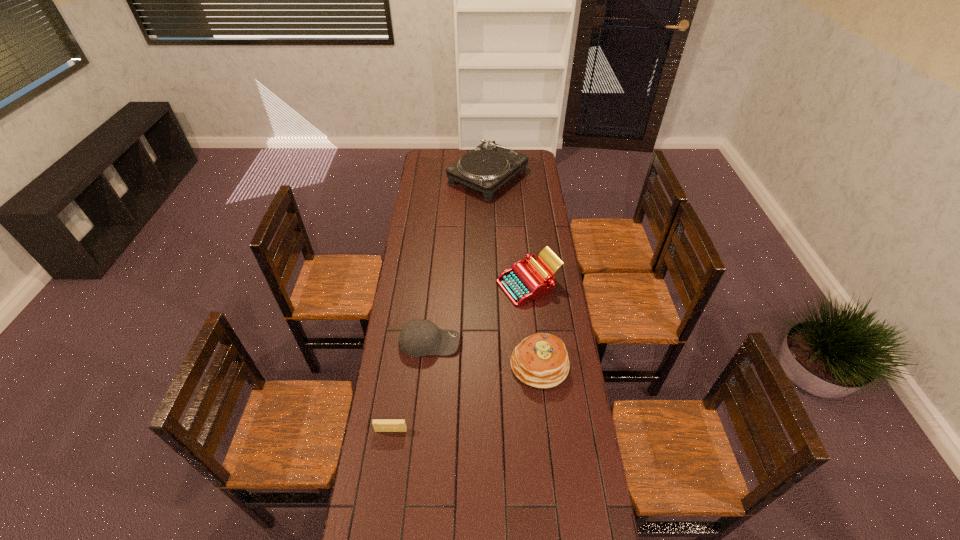
At what (x,y) coordinates should I click in order to perform the action: click on the farthest object. Please return your answer as a coordinate pair (x, y). The width and height of the screenshot is (960, 540). Looking at the image, I should click on (487, 167).

Find the location of a particular element. The height and width of the screenshot is (540, 960). typewriter is located at coordinates (525, 281).

Find the location of `baseball cap`. baseball cap is located at coordinates (418, 337).

I want to click on pancake, so click(541, 360).

Locate an element on the screen. This screenshot has height=540, width=960. the shortest object is located at coordinates (380, 425).

This screenshot has height=540, width=960. I want to click on videotape, so 380,425.

Image resolution: width=960 pixels, height=540 pixels. In order to click on vacant space located 0.210m on the front of the record player in this screenshot , I will do `click(489, 225)`.

Locate an element on the screen. The height and width of the screenshot is (540, 960). free location located 0.380m on the typing side of the fourth nearest object is located at coordinates (413, 285).

Find the location of a particular element. The width and height of the screenshot is (960, 540). vacant space located 0.090m on the typing side of the fourth nearest object is located at coordinates (476, 285).

The width and height of the screenshot is (960, 540). Find the location of `vacant area located on the typing side of the fourth nearest object`. vacant area located on the typing side of the fourth nearest object is located at coordinates (409, 285).